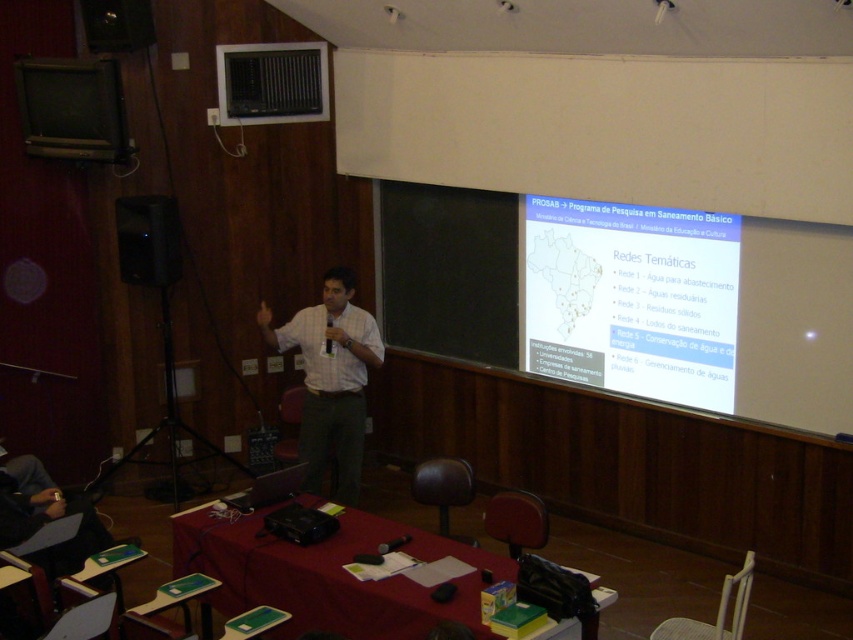
You are a student sitting at the back of the classroom. You see the red fabric table at lower center and the white shirt at center. Which object is closer to the front of the room?

The white shirt at center is closer to the front of the room because it is above the red fabric table at lower center, which is positioned below it.

You are a student sitting at the back of the classroom. You need to place your laptop on the red fabric table at lower center and the white shirt at center. Which object can you place your laptop on?

The red fabric table at lower center is larger in size than the white shirt at center, so you can place your laptop on the red fabric table at lower center.